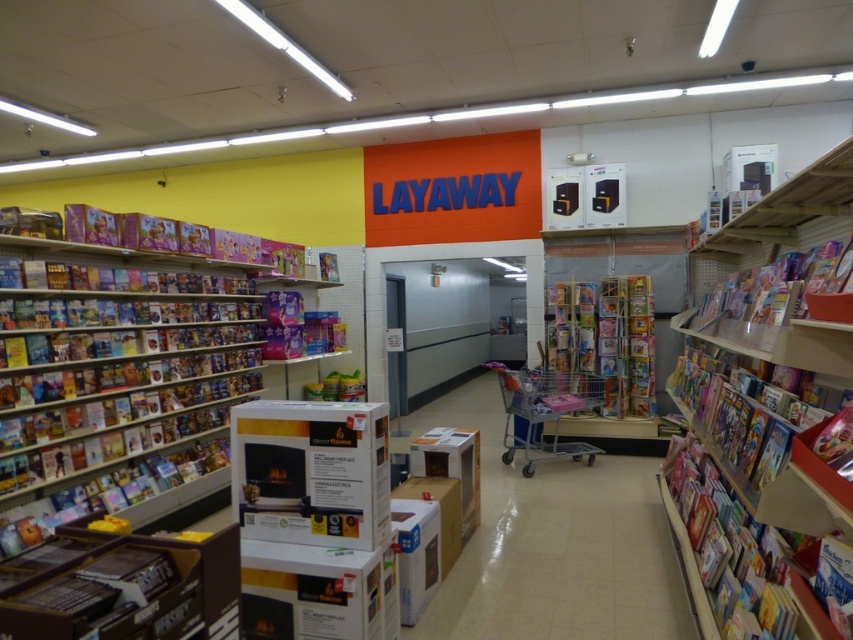
Which is more to the left, wooden bookshelf at upper right or metallic silver shopping cart at center?

metallic silver shopping cart at center

Is wooden bookshelf at upper right wider than metallic silver shopping cart at center?

Correct, the width of wooden bookshelf at upper right exceeds that of metallic silver shopping cart at center.

Between point (808, 227) and point (592, 396), which one is positioned in front?

Positioned in front is point (808, 227).

What are the coordinates of `wooden bookshelf at upper right` in the screenshot? It's located at (759, 449).

Consider the image. Can you confirm if multicolored cardboard books at left is wider than metallic silver shopping cart at center?

Incorrect, multicolored cardboard books at left's width does not surpass metallic silver shopping cart at center's.

This screenshot has height=640, width=853. Identify the location of multicolored cardboard books at left. (119, 369).

Is cardboard boxes at center below metallic silver shopping cart at center?

Correct, cardboard boxes at center is located below metallic silver shopping cart at center.

Is cardboard boxes at center smaller than metallic silver shopping cart at center?

Correct, cardboard boxes at center occupies less space than metallic silver shopping cart at center.

Which is in front, point (552, 552) or point (529, 413)?

Positioned in front is point (552, 552).

Find the location of `cardboard boxes at center`. cardboard boxes at center is located at coordinates (555, 545).